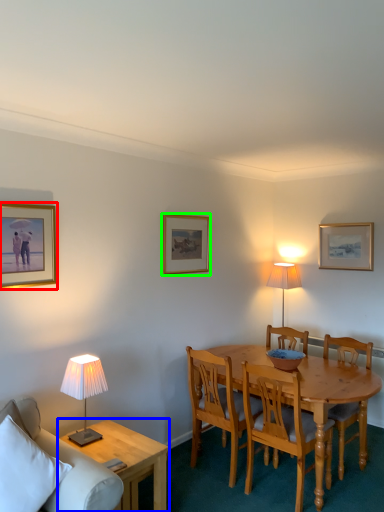
Question: Which object is the farthest from picture frame (highlighted by a red box)? Choose among these: coffee table (highlighted by a blue box) or picture frame (highlighted by a green box).

Choices:
 (A) coffee table
 (B) picture frame

Answer: (A)